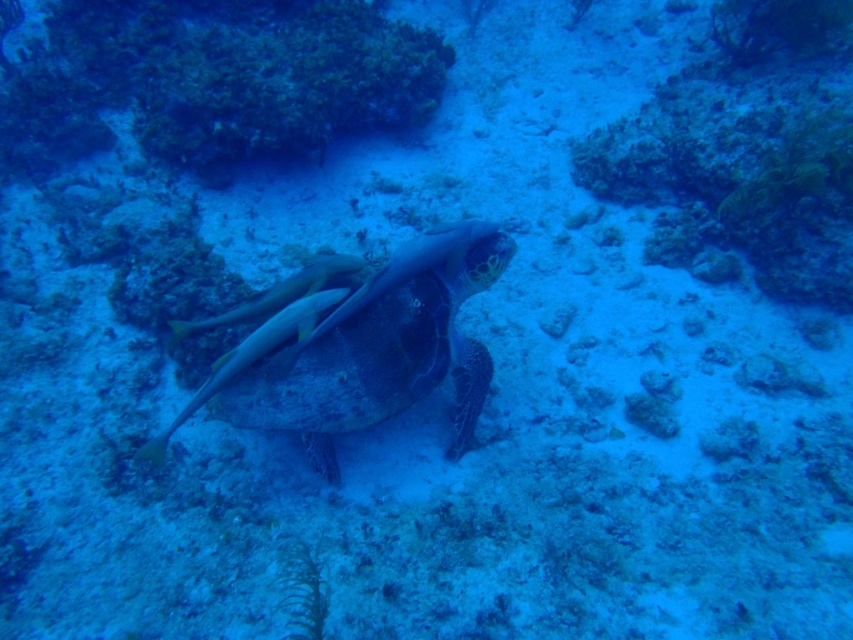
Question: Does green textured shell at center appear under yellow-green textured fish at center?

Choices:
 (A) no
 (B) yes

Answer: (B)

Question: In this image, where is green textured shell at center located relative to yellow-green textured fish at center?

Choices:
 (A) right
 (B) left

Answer: (A)

Question: Does green textured shell at center appear on the right side of yellow-green textured fish at center?

Choices:
 (A) no
 (B) yes

Answer: (B)

Question: Which object is the closest to the smooth yellow fish at center?

Choices:
 (A) yellow-green textured fish at center
 (B) green textured shell at center

Answer: (A)

Question: Estimate the real-world distances between objects in this image. Which object is closer to the yellow-green textured fish at center?

Choices:
 (A) green textured shell at center
 (B) smooth yellow fish at center

Answer: (B)

Question: Which object appears closest to the camera in this image?

Choices:
 (A) yellow-green textured fish at center
 (B) smooth yellow fish at center

Answer: (A)